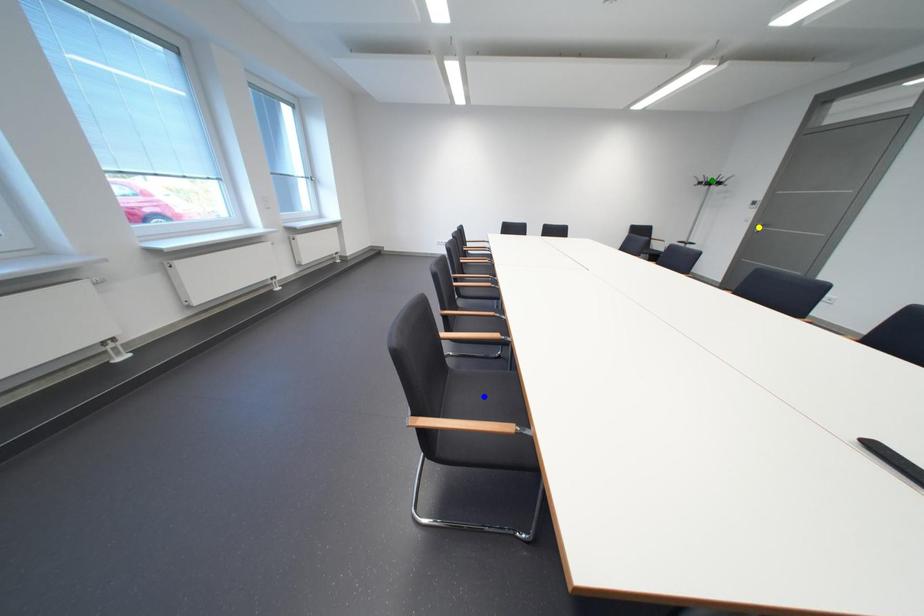
Order these from nearest to farthest:
1. green point
2. blue point
3. yellow point

blue point
yellow point
green point